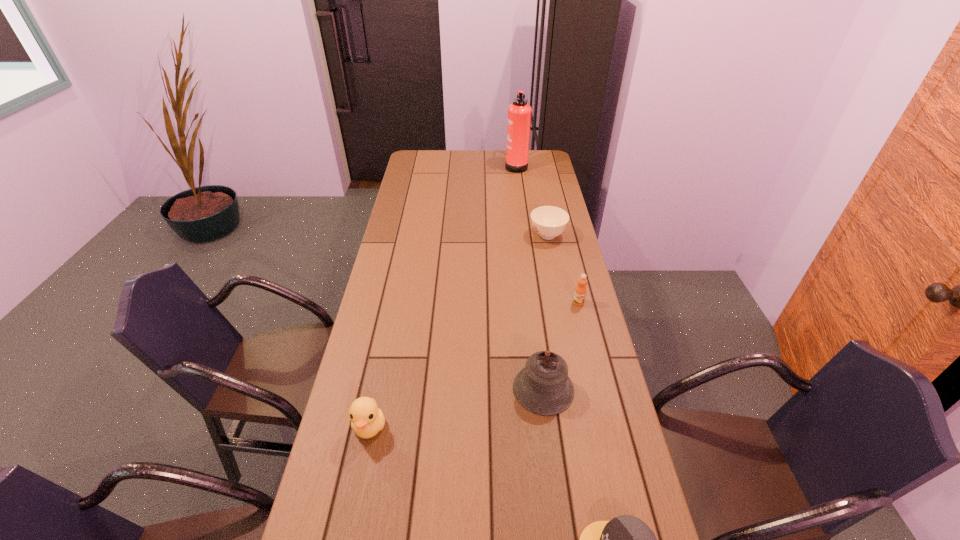
Identify the location of vacant area that lies between the orange juice and the leftmost object. (474, 364).

This screenshot has width=960, height=540. I want to click on free point between the fifth tallest object and the leftmost object, so click(459, 331).

Identify which object is the fourth nearest to the duck. Please provide its 2D coordinates. Your answer should be formatted as a tuple, i.e. [(x, y)], where the tuple contains the x and y coordinates of a point satisfying the conditions above.

[(548, 222)]

Identify the location of object that is the third closest to the cap. This screenshot has height=540, width=960. (580, 291).

You are a GUI agent. You are given a task and a screenshot of the screen. Output one action in this format:
    pyautogui.click(x=<x>, y=<y>)
    Task: Click on the free spot that satisfies the following two spatial constraints: 1. at the nozzle of the farthest object; 2. on the face of the leftmost object
    Image resolution: width=960 pixels, height=540 pixels.
    Given the screenshot: What is the action you would take?
    pyautogui.click(x=551, y=426)